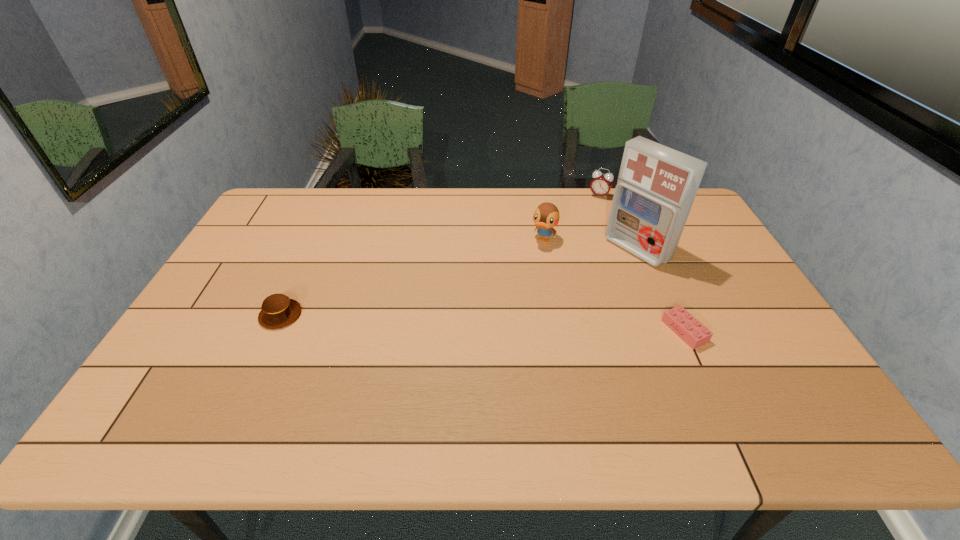
The height and width of the screenshot is (540, 960). Find the location of `muffin`. muffin is located at coordinates (278, 311).

This screenshot has width=960, height=540. Identify the location of the leftmost object. (278, 311).

This screenshot has width=960, height=540. In order to click on Lego in this screenshot , I will do `click(680, 321)`.

Identify the location of the third tallest object. (601, 184).

Find the location of a particular element. The height and width of the screenshot is (540, 960). alarm clock is located at coordinates (601, 184).

Locate an element on the screen. the second tallest object is located at coordinates (546, 216).

Where is `the fourth object from right to left`? Image resolution: width=960 pixels, height=540 pixels. the fourth object from right to left is located at coordinates (x=546, y=216).

Image resolution: width=960 pixels, height=540 pixels. Find the location of `the tallest object`. the tallest object is located at coordinates (656, 187).

In order to click on vacant space located 0.110m on the left of the leftmost object in this screenshot , I will do `click(220, 315)`.

Where is `vacant space located on the right of the shortest object`? vacant space located on the right of the shortest object is located at coordinates (731, 331).